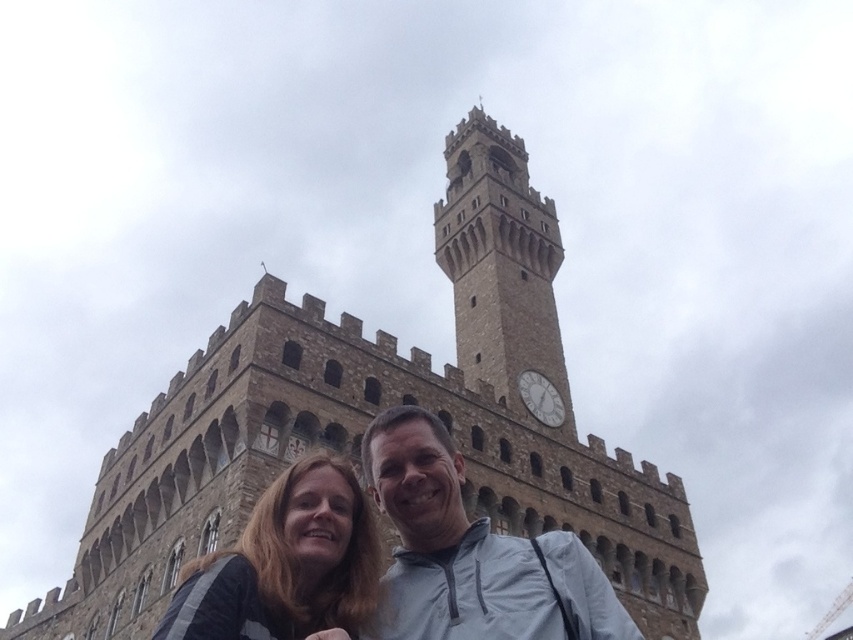
Question: Considering the real-world distances, which object is closest to the blonde hair at center?

Choices:
 (A) stone clock tower at center
 (B) matte gray jacket at center
 (C) brown stone tower at center

Answer: (B)

Question: Does brown stone tower at center appear under stone clock tower at center?

Choices:
 (A) yes
 (B) no

Answer: (A)

Question: Which of the following is the closest to the observer?

Choices:
 (A) blonde hair at center
 (B) matte gray jacket at center

Answer: (A)

Question: Is matte gray jacket at center bigger than stone clock tower at center?

Choices:
 (A) no
 (B) yes

Answer: (A)

Question: Is matte gray jacket at center positioned at the back of blonde hair at center?

Choices:
 (A) yes
 (B) no

Answer: (A)

Question: Which point is closer to the camera?

Choices:
 (A) (444, 374)
 (B) (509, 540)
 (C) (366, 579)
 (D) (457, 134)

Answer: (C)